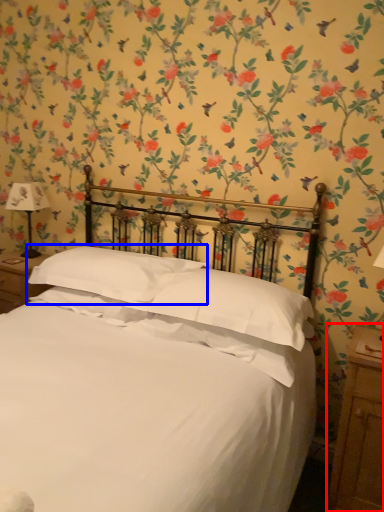
Question: Among these objects, which one is farthest to the camera, nightstand (highlighted by a red box) or pillow (highlighted by a blue box)?

Choices:
 (A) nightstand
 (B) pillow

Answer: (B)